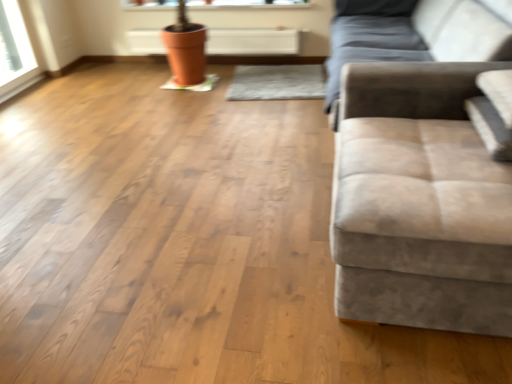
Question: Is white glossy window sill at upper center not near orange clay pot at upper center?

Choices:
 (A) yes
 (B) no

Answer: (B)

Question: Is white glossy window sill at upper center positioned beyond the bounds of orange clay pot at upper center?

Choices:
 (A) no
 (B) yes

Answer: (B)

Question: Considering the relative positions of white glossy window sill at upper center and orange clay pot at upper center in the image provided, is white glossy window sill at upper center to the left of orange clay pot at upper center from the viewer's perspective?

Choices:
 (A) no
 (B) yes

Answer: (B)

Question: Is white glossy window sill at upper center bigger than orange clay pot at upper center?

Choices:
 (A) yes
 (B) no

Answer: (B)

Question: Is orange clay pot at upper center completely or partially inside white glossy window sill at upper center?

Choices:
 (A) no
 (B) yes

Answer: (A)

Question: Is white glossy window sill at upper center next to orange clay pot at upper center and touching it?

Choices:
 (A) no
 (B) yes

Answer: (A)

Question: Is orange clay pot at upper center at the right side of suede-like beige studio couch at right?

Choices:
 (A) yes
 (B) no

Answer: (B)

Question: From the image's perspective, is orange clay pot at upper center over suede-like beige studio couch at right?

Choices:
 (A) no
 (B) yes

Answer: (B)

Question: Could you tell me if orange clay pot at upper center is facing suede-like beige studio couch at right?

Choices:
 (A) yes
 (B) no

Answer: (A)

Question: From a real-world perspective, does orange clay pot at upper center stand above suede-like beige studio couch at right?

Choices:
 (A) no
 (B) yes

Answer: (A)

Question: Is orange clay pot at upper center facing away from suede-like beige studio couch at right?

Choices:
 (A) no
 (B) yes

Answer: (A)

Question: Considering the relative sizes of orange clay pot at upper center and suede-like beige studio couch at right in the image provided, is orange clay pot at upper center thinner than suede-like beige studio couch at right?

Choices:
 (A) no
 (B) yes

Answer: (B)

Question: From the image's perspective, does suede-like beige studio couch at right appear lower than orange clay pot at upper center?

Choices:
 (A) no
 (B) yes

Answer: (B)